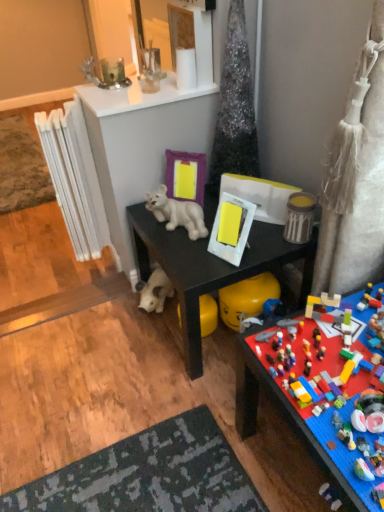
Locate an element on the screen. The width and height of the screenshot is (384, 512). free space in front of white glossy plastic lion at center, which is counted as the 4th toy, starting from the bottom is located at coordinates (197, 262).